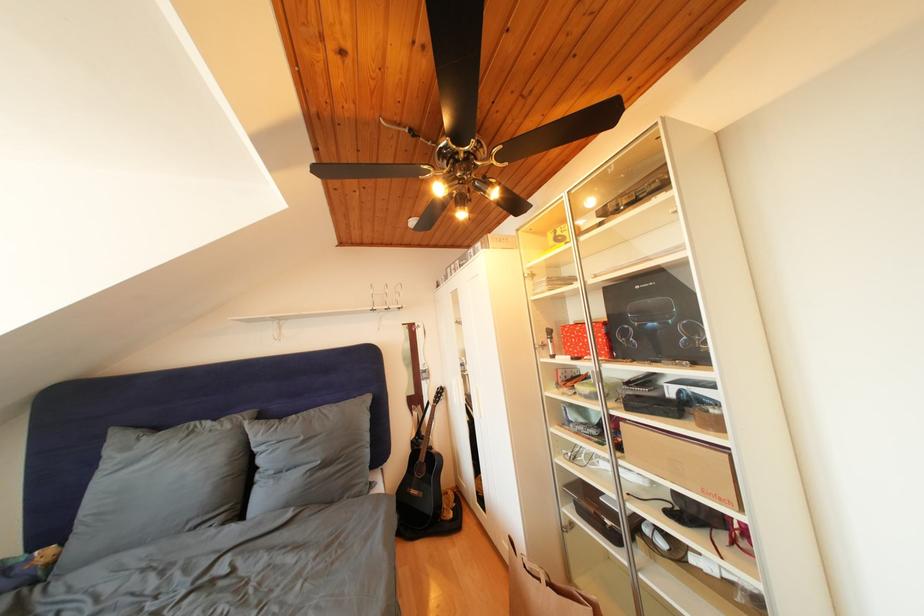
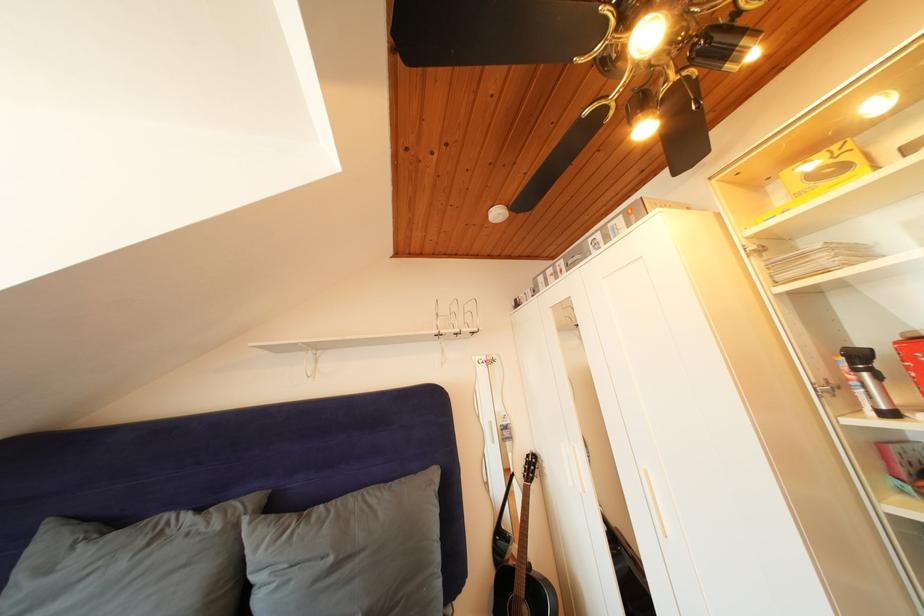
Question: How did the camera likely rotate?

Choices:
 (A) Left
 (B) Right
 (C) Up
 (D) Down

Answer: (C)